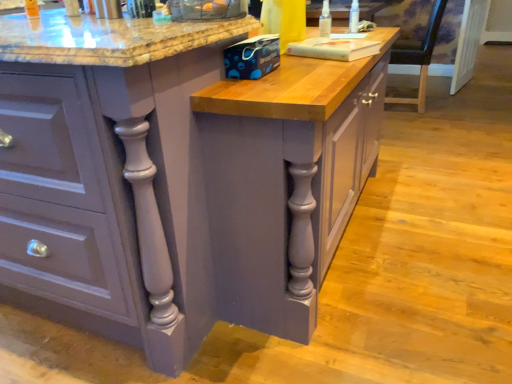
Question: Is wooden chair at right wider than transparent plastic spray bottle at upper right, the 1th bottle in the back-to-front sequence?

Choices:
 (A) no
 (B) yes

Answer: (B)

Question: Could you tell me if wooden chair at right is facing transparent plastic spray bottle at upper right, which ranks as the 2th bottle in front-to-back order?

Choices:
 (A) yes
 (B) no

Answer: (B)

Question: Considering the relative sizes of wooden chair at right and transparent plastic spray bottle at upper right, which ranks as the 2th bottle in front-to-back order, in the image provided, is wooden chair at right smaller than transparent plastic spray bottle at upper right, which ranks as the 2th bottle in front-to-back order,?

Choices:
 (A) yes
 (B) no

Answer: (B)

Question: Is wooden chair at right further to camera compared to transparent plastic spray bottle at upper right, the 1th bottle in the back-to-front sequence?

Choices:
 (A) yes
 (B) no

Answer: (A)

Question: From a real-world perspective, is wooden chair at right below transparent plastic spray bottle at upper right, which ranks as the 2th bottle in front-to-back order?

Choices:
 (A) no
 (B) yes

Answer: (B)

Question: From the image's perspective, is matte gray cabinet at center positioned above or below clear plastic spray bottle at upper right, the 2th bottle from the back?

Choices:
 (A) below
 (B) above

Answer: (A)

Question: Considering the positions of point (16, 142) and point (327, 23), is point (16, 142) closer or farther from the camera than point (327, 23)?

Choices:
 (A) closer
 (B) farther

Answer: (A)

Question: Relative to clear plastic spray bottle at upper right, the 2th bottle from the back, is matte gray cabinet at center in front or behind?

Choices:
 (A) behind
 (B) front

Answer: (B)

Question: Is matte gray cabinet at center wider or thinner than clear plastic spray bottle at upper right, arranged as the 2th bottle when viewed from the right?

Choices:
 (A) thin
 (B) wide

Answer: (B)

Question: From the image's perspective, is clear plastic spray bottle at upper right, which is the first bottle in front-to-back order, located above or below matte gray cabinet at center?

Choices:
 (A) below
 (B) above

Answer: (B)

Question: Is clear plastic spray bottle at upper right, the 2th bottle from the back, bigger or smaller than matte gray cabinet at center?

Choices:
 (A) small
 (B) big

Answer: (A)

Question: From their relative heights in the image, would you say clear plastic spray bottle at upper right, the 2th bottle from the back, is taller or shorter than matte gray cabinet at center?

Choices:
 (A) short
 (B) tall

Answer: (A)

Question: Looking at their shapes, would you say clear plastic spray bottle at upper right, the 2th bottle from the back, is wider or thinner than matte gray cabinet at center?

Choices:
 (A) thin
 (B) wide

Answer: (A)

Question: Relative to transparent plastic spray bottle at upper right, marked as the first bottle in a right-to-left arrangement, is wooden chair at right in front or behind?

Choices:
 (A) front
 (B) behind

Answer: (B)

Question: From a real-world perspective, is wooden chair at right physically located above or below transparent plastic spray bottle at upper right, the 1th bottle in the back-to-front sequence?

Choices:
 (A) above
 (B) below

Answer: (B)